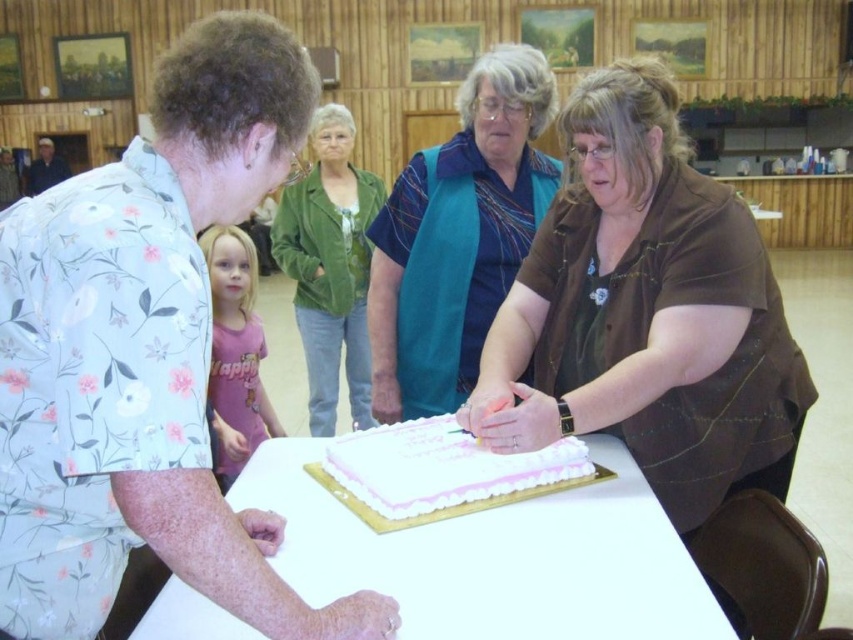
Is point (575, 371) positioned in front of point (399, 243)?

Yes, point (575, 371) is closer to viewer.

Is matte brown shirt at center to the right of blue fabric vest at center from the viewer's perspective?

Correct, you'll find matte brown shirt at center to the right of blue fabric vest at center.

Find the location of a particular element. The height and width of the screenshot is (640, 853). matte brown shirt at center is located at coordinates (646, 314).

In the scene shown: Is blue fabric vest at center thinner than dark blue shirt at upper left?

Yes, blue fabric vest at center is thinner than dark blue shirt at upper left.

Is point (424, 189) positioned after point (38, 188)?

No, it is in front of (38, 188).

Between point (396, 417) and point (61, 179), which one is positioned in front?

Positioned in front is point (396, 417).

The width and height of the screenshot is (853, 640). I want to click on blue fabric vest at center, so click(x=457, y=236).

Is white glossy table at center thinner than white frosted cake at center?

In fact, white glossy table at center might be wider than white frosted cake at center.

I want to click on white glossy table at center, so tap(495, 557).